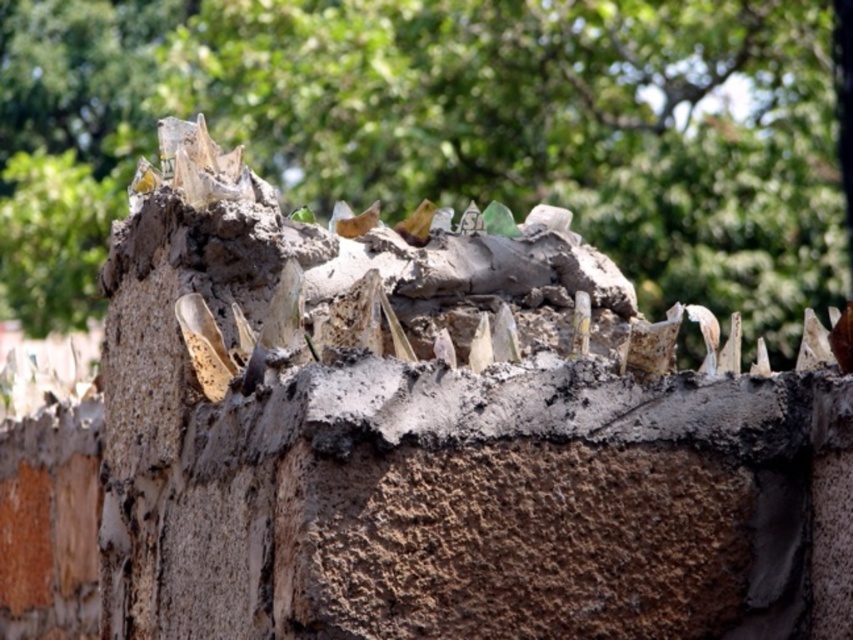
You are standing in front of a wall and see the brown rough stone at upper center and the green leafy tree at upper center. Which object is closer to you?

The brown rough stone at upper center is closer to you because it is in front of the green leafy tree at upper center.

You are an archaeologist examining the wall and notice the brown rough stone at upper center. What are the coordinates of this stone relative to the image?

The brown rough stone at upper center is located at point (439, 440).